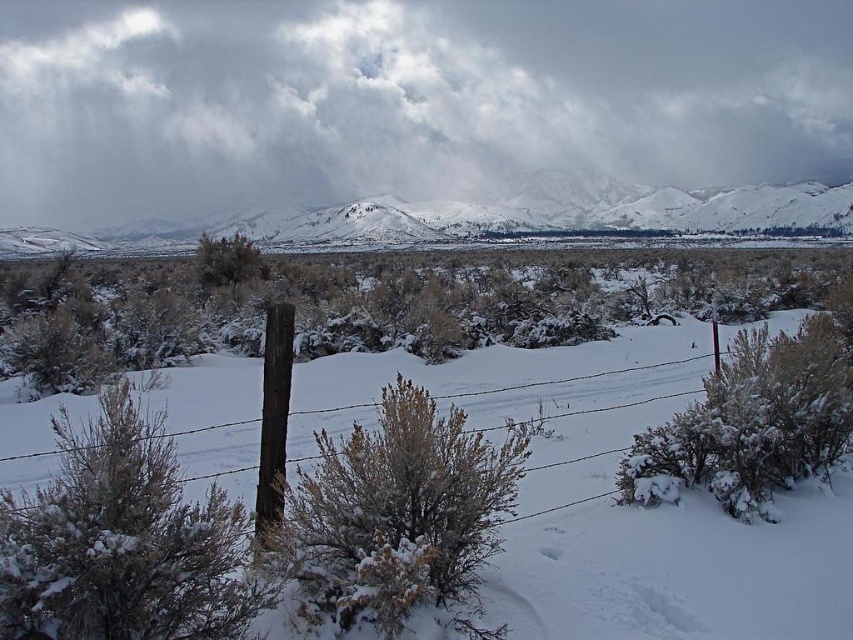
Question: Does fuzzy snow-covered bush at center have a greater width compared to brown wood post at center?

Choices:
 (A) no
 (B) yes

Answer: (B)

Question: Which of the following is the farthest from the observer?

Choices:
 (A) fuzzy snow-covered bush at center
 (B) white fluffy bush at left

Answer: (A)

Question: From the image, what is the correct spatial relationship of fuzzy snow-covered bush at center in relation to brown wood post at center?

Choices:
 (A) left
 (B) right

Answer: (B)

Question: Is white fluffy bush at left above snow-covered mountain at upper center?

Choices:
 (A) yes
 (B) no

Answer: (B)

Question: Which of the following is the farthest from the observer?

Choices:
 (A) (405, 540)
 (B) (67, 250)

Answer: (B)

Question: Based on their relative distances, which object is nearer to the white fluffy bush at center?

Choices:
 (A) white fluffy bush at left
 (B) snow-covered mountain at upper center
 (C) fuzzy snow-covered bush at center

Answer: (C)